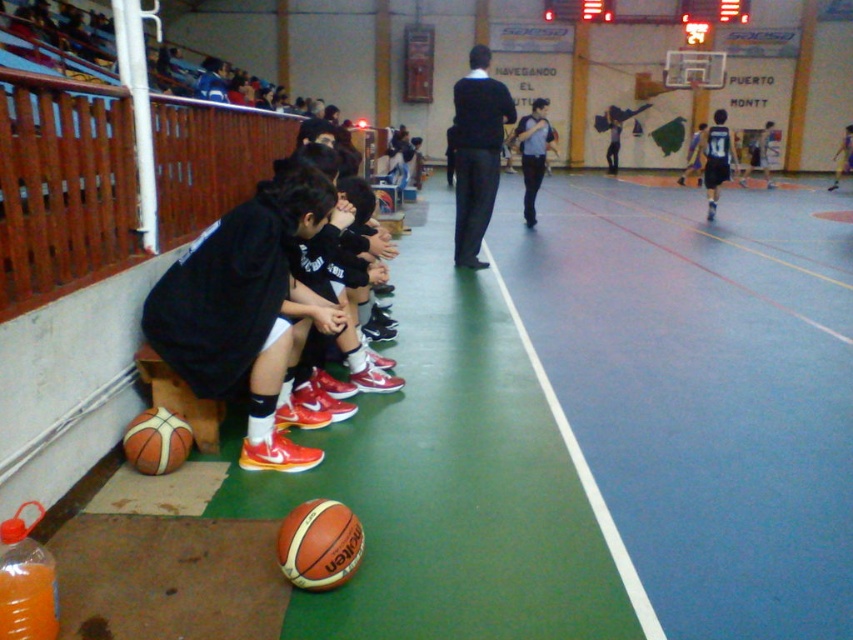
You are a photographer standing at the entrance of the gym. You want to take a photo of the black matte jacket at center. Which direction should you move to get a better shot?

The black matte jacket at center is located at coordinates approximately 0.239 on the x axis and 0.559 on the y axis. To get a better shot, move towards the left side of the gym entrance where the jacket is positioned.

You are a gym janitor and need to retrieve the orange leather basketball at lower left and the leather textured basketball at lower left from the floor. Which basketball should you pick up first if you want to get the one that is on top?

You should pick up the orange leather basketball at lower left first because it is positioned under the leather textured basketball at lower left, so the leather textured basketball is on top.